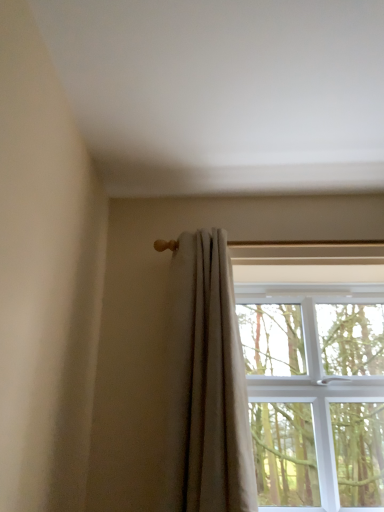
Question: Can you confirm if light beige fabric curtain at upper right is thinner than clear glass window at upper right?

Choices:
 (A) no
 (B) yes

Answer: (B)

Question: Can you confirm if light beige fabric curtain at upper right is bigger than clear glass window at upper right?

Choices:
 (A) yes
 (B) no

Answer: (B)

Question: Considering the relative sizes of light beige fabric curtain at upper right and clear glass window at upper right in the image provided, is light beige fabric curtain at upper right taller than clear glass window at upper right?

Choices:
 (A) yes
 (B) no

Answer: (A)

Question: Considering the relative sizes of light beige fabric curtain at upper right and clear glass window at upper right in the image provided, is light beige fabric curtain at upper right wider than clear glass window at upper right?

Choices:
 (A) no
 (B) yes

Answer: (A)

Question: Does light beige fabric curtain at upper right come behind clear glass window at upper right?

Choices:
 (A) no
 (B) yes

Answer: (A)

Question: From a real-world perspective, is light beige fabric curtain at upper right physically below clear glass window at upper right?

Choices:
 (A) no
 (B) yes

Answer: (A)

Question: Does clear glass window at upper right come behind light beige fabric curtain at upper right?

Choices:
 (A) no
 (B) yes

Answer: (B)

Question: Is there a large distance between clear glass window at upper right and light beige fabric curtain at upper right?

Choices:
 (A) no
 (B) yes

Answer: (A)

Question: Can we say clear glass window at upper right lies outside light beige fabric curtain at upper right?

Choices:
 (A) yes
 (B) no

Answer: (A)

Question: Is clear glass window at upper right directly adjacent to light beige fabric curtain at upper right?

Choices:
 (A) no
 (B) yes

Answer: (A)

Question: From the image's perspective, is clear glass window at upper right beneath light beige fabric curtain at upper right?

Choices:
 (A) yes
 (B) no

Answer: (A)

Question: Can you confirm if clear glass window at upper right is positioned to the right of light beige fabric curtain at upper right?

Choices:
 (A) yes
 (B) no

Answer: (A)

Question: Is light beige fabric curtain at upper right bigger or smaller than clear glass window at upper right?

Choices:
 (A) big
 (B) small

Answer: (B)